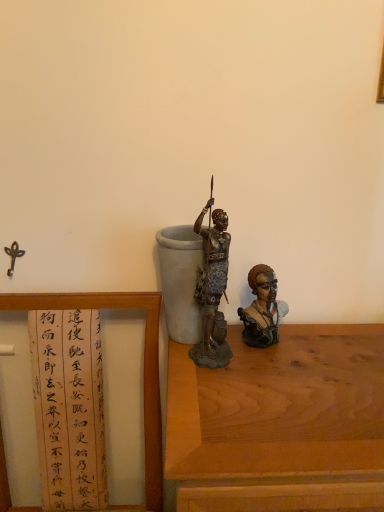
Question: Can you confirm if bronze statue at center, the first person in the left-to-right sequence, is bigger than matte brown bust at right, which is counted as the 1th person, starting from the right?

Choices:
 (A) yes
 (B) no

Answer: (A)

Question: Would you consider bronze statue at center, the first person in the left-to-right sequence, to be distant from matte brown bust at right, marked as the 2th person in a left-to-right arrangement?

Choices:
 (A) no
 (B) yes

Answer: (A)

Question: Considering the relative sizes of bronze statue at center, the second person when ordered from right to left, and matte brown bust at right, which is counted as the 1th person, starting from the right, in the image provided, is bronze statue at center, the second person when ordered from right to left, taller than matte brown bust at right, which is counted as the 1th person, starting from the right,?

Choices:
 (A) no
 (B) yes

Answer: (B)

Question: From a real-world perspective, is bronze statue at center, the second person when ordered from right to left, on top of matte brown bust at right, which is counted as the 1th person, starting from the right?

Choices:
 (A) yes
 (B) no

Answer: (A)

Question: Is bronze statue at center, the first person in the left-to-right sequence, oriented towards matte brown bust at right, which is counted as the 1th person, starting from the right?

Choices:
 (A) yes
 (B) no

Answer: (B)

Question: Is wooden framed paper at left wider or thinner than bronze statue at center, the first person in the left-to-right sequence?

Choices:
 (A) wide
 (B) thin

Answer: (A)

Question: Relative to bronze statue at center, the first person in the left-to-right sequence, is wooden framed paper at left in front or behind?

Choices:
 (A) front
 (B) behind

Answer: (A)

Question: From the image's perspective, is wooden framed paper at left located above or below bronze statue at center, the first person in the left-to-right sequence?

Choices:
 (A) below
 (B) above

Answer: (A)

Question: From a real-world perspective, is wooden framed paper at left positioned above or below bronze statue at center, the second person when ordered from right to left?

Choices:
 (A) above
 (B) below

Answer: (B)

Question: Based on their sizes in the image, would you say matte brown bust at right, marked as the 2th person in a left-to-right arrangement, is bigger or smaller than wooden framed paper at left?

Choices:
 (A) big
 (B) small

Answer: (B)

Question: Which is correct: matte brown bust at right, which is counted as the 1th person, starting from the right, is inside wooden framed paper at left, or outside of it?

Choices:
 (A) inside
 (B) outside

Answer: (B)

Question: Looking at their shapes, would you say matte brown bust at right, marked as the 2th person in a left-to-right arrangement, is wider or thinner than wooden framed paper at left?

Choices:
 (A) thin
 (B) wide

Answer: (A)

Question: From the image's perspective, is matte brown bust at right, marked as the 2th person in a left-to-right arrangement, above or below wooden framed paper at left?

Choices:
 (A) below
 (B) above

Answer: (B)

Question: Based on their sizes in the image, would you say wooden framed paper at left is bigger or smaller than wooden table at center?

Choices:
 (A) big
 (B) small

Answer: (B)

Question: Is wooden framed paper at left spatially inside wooden table at center, or outside of it?

Choices:
 (A) inside
 (B) outside

Answer: (B)